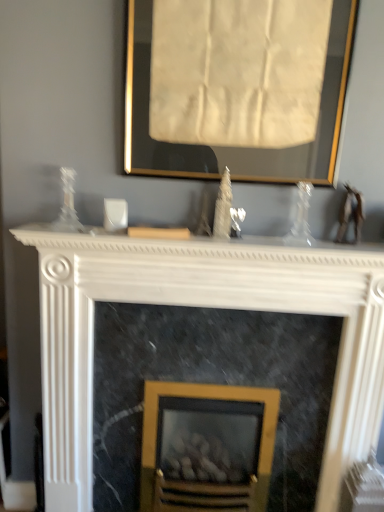
Question: Which direction should I rotate to face gold-framed fireplace at center, acting as the 1th fireplace starting from the back, — up or down?

Choices:
 (A) down
 (B) up

Answer: (A)

Question: Does marble fireplace at center, marked as the 2th fireplace in a back-to-front arrangement, contain white marble fireplace at center?

Choices:
 (A) yes
 (B) no

Answer: (B)

Question: Is marble fireplace at center, marked as the 2th fireplace in a back-to-front arrangement, at the right side of white marble fireplace at center?

Choices:
 (A) no
 (B) yes

Answer: (B)

Question: Does marble fireplace at center, marked as the 2th fireplace in a back-to-front arrangement, have a greater width compared to white marble fireplace at center?

Choices:
 (A) no
 (B) yes

Answer: (A)

Question: Considering the relative sizes of marble fireplace at center, marked as the 2th fireplace in a back-to-front arrangement, and white marble fireplace at center in the image provided, is marble fireplace at center, marked as the 2th fireplace in a back-to-front arrangement, thinner than white marble fireplace at center?

Choices:
 (A) no
 (B) yes

Answer: (B)

Question: From the image's perspective, is marble fireplace at center, marked as the 2th fireplace in a back-to-front arrangement, over white marble fireplace at center?

Choices:
 (A) no
 (B) yes

Answer: (A)

Question: Does marble fireplace at center, acting as the second fireplace starting from the front, have a smaller size compared to white marble fireplace at center?

Choices:
 (A) yes
 (B) no

Answer: (B)

Question: Is white marble fireplace at center smaller than gold-framed artwork at upper center?

Choices:
 (A) yes
 (B) no

Answer: (A)

Question: From a real-world perspective, does white marble fireplace at center stand above gold-framed artwork at upper center?

Choices:
 (A) yes
 (B) no

Answer: (B)

Question: Is the depth of white marble fireplace at center greater than that of gold-framed artwork at upper center?

Choices:
 (A) yes
 (B) no

Answer: (A)

Question: Can you confirm if white marble fireplace at center is thinner than gold-framed artwork at upper center?

Choices:
 (A) yes
 (B) no

Answer: (B)

Question: From the image's perspective, is white marble fireplace at center on top of gold-framed artwork at upper center?

Choices:
 (A) yes
 (B) no

Answer: (B)

Question: Is white marble fireplace at center looking in the opposite direction of gold-framed artwork at upper center?

Choices:
 (A) yes
 (B) no

Answer: (B)

Question: Can you confirm if white marble fireplace at center is bigger than marble fireplace at center, acting as the second fireplace starting from the front?

Choices:
 (A) yes
 (B) no

Answer: (B)